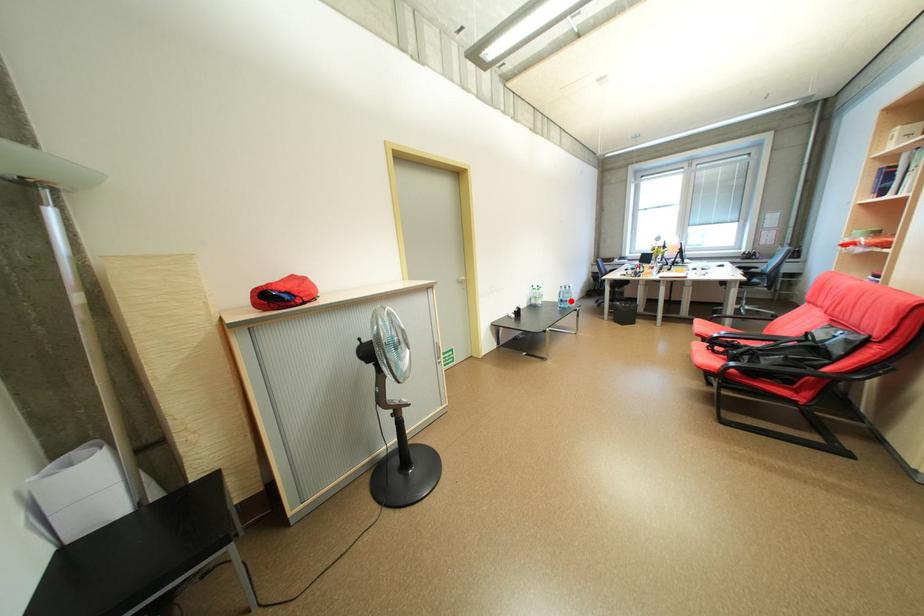
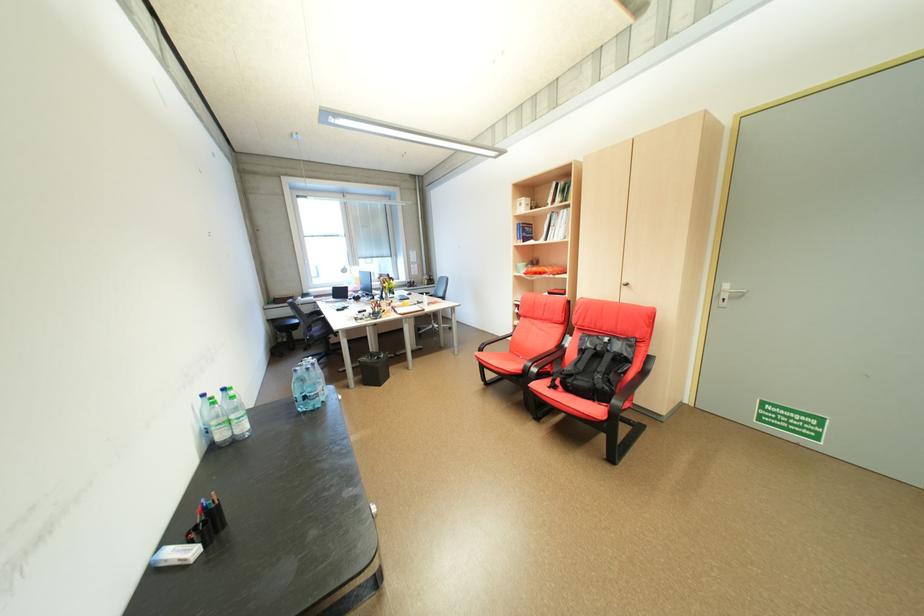
Question: I am providing you with two images of the same scene from different viewpoints. In image1, a red point is highlighted. Considering the same 3D point in image2, which of the following is correct?

Choices:
 (A) It is closer
 (B) It is farther

Answer: (A)